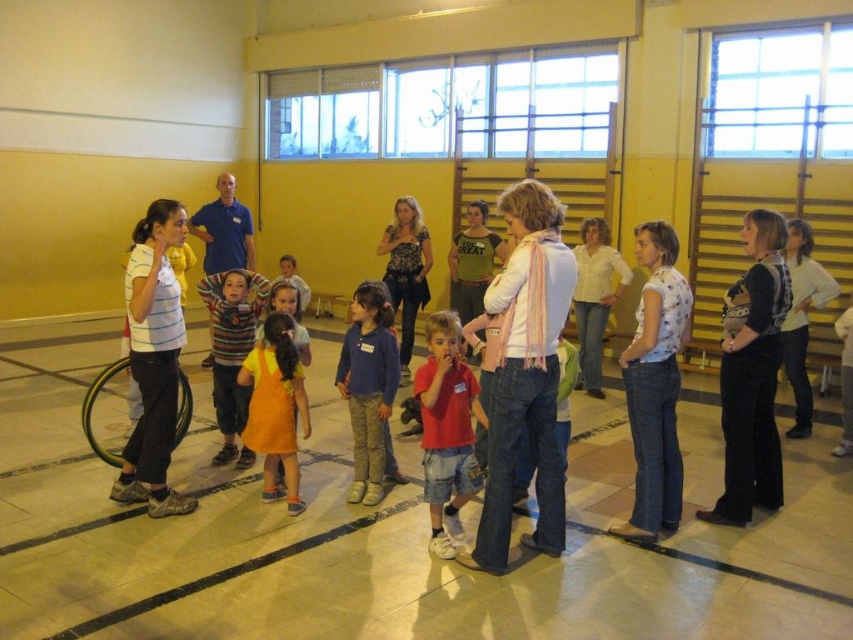
You are standing in the gymnasium and want to move from point A to point B. Point A is located at coordinates point [764,243] and point B is at point [662,470]. Since you need to avoid the group of people in the semi circle formation, which direction should you move first to go from point A to point B without passing through the group?

Since point [764,243] is further to the camera than point [662,470], you should move forward towards the group to get closer to them before turning sideways to go around them, ensuring you don not pass through the group.

You are an event planner arranging a photo shoot in this gymnasium. You need to position a camera so that both the orange cotton dress at center and the blue shirt at center are clearly visible in the frame. Considering their positions, where should you place the camera relative to the semi circle formation?

The orange cotton dress at center is positioned under the blue shirt at center. To capture both in the frame, place the camera above the blue shirt at center so that the orange cotton dress at center is visible below it.